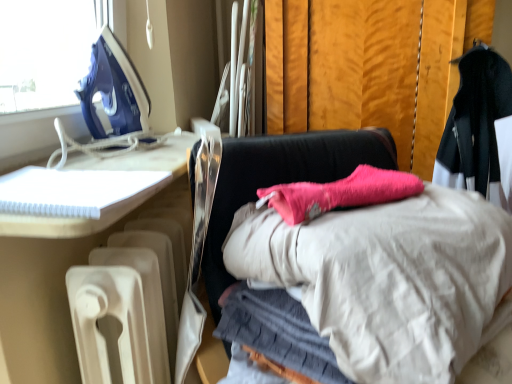
Find the location of a particular element. The image size is (512, 384). free space above white plastic notebook at left, which ranks as the 3th furniture in right-to-left order (from a real-world perspective) is located at coordinates (98, 167).